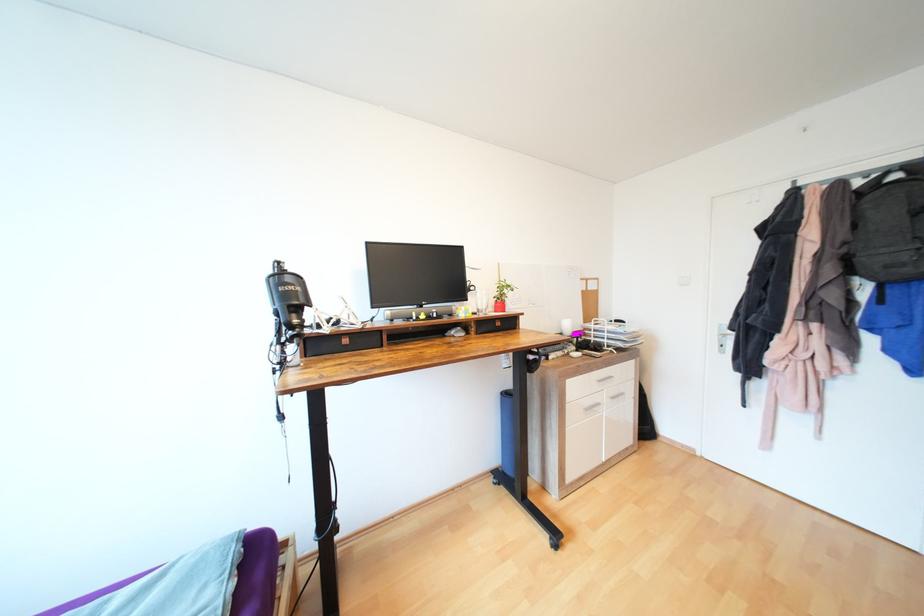
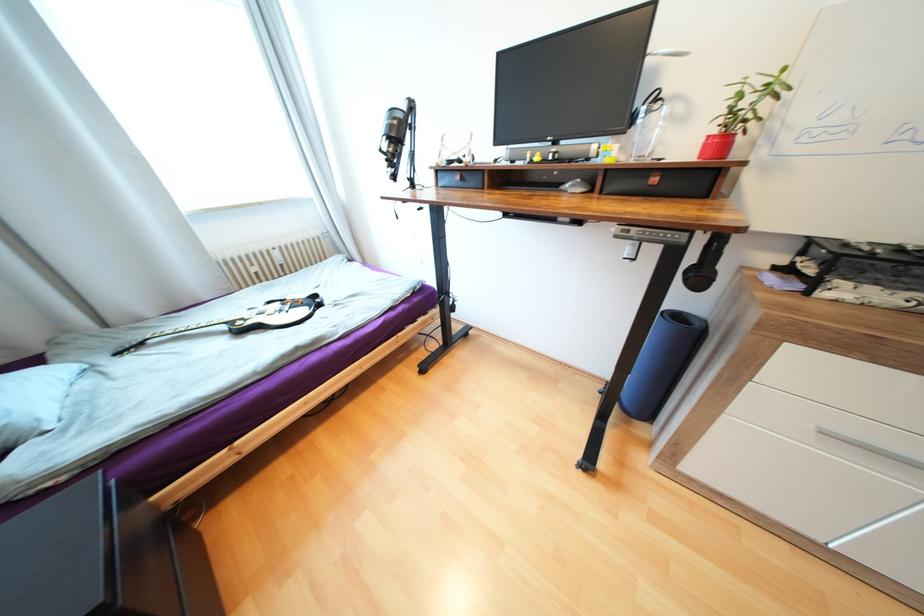
First-person continuous shooting, in which direction is the camera rotating?

The rotation direction of the camera is left-down.